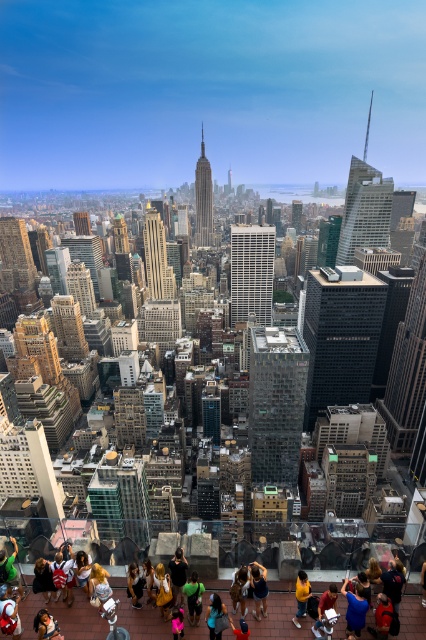
You are a drone operator trying to navigate between two points in the city. The first point is at coordinates point (x=184, y=588) and the second is at point (x=249, y=628). Based on the city layout, which point is closer to the Empire State Building?

Point (x=184, y=588) is behind point (x=249, y=628), so the closer point to the Empire State Building would be point (x=249, y=628) since it is in front.

You are a photographer standing on a viewing platform with a glass railing, and you want to take a picture of the Empire State Building. There is a person wearing a dark gray hoodie at center blocking your view. Where should you move to avoid the person?

You should move to the left or right of the dark gray hoodie at center to avoid blocking the view of the Empire State Building.

You are a photographer standing on a viewing platform with a glass railing. You notice two people wearing a dark gray hoodie at center and dark blue denim shorts at center. Which clothing item is taller?

The dark gray hoodie at center is taller than the dark blue denim shorts at center.